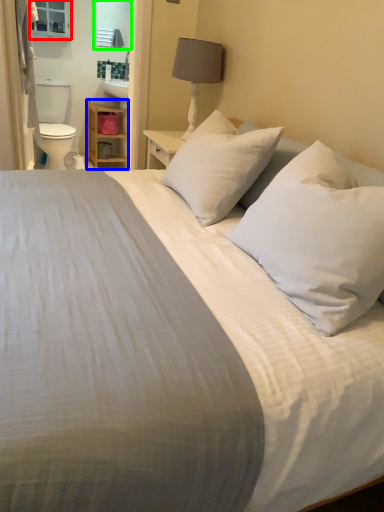
Question: Based on their relative distances, which object is nearer to medicine cabinet (highlighted by a red box)? Choose from dresser (highlighted by a blue box) and mirror (highlighted by a green box).

Choices:
 (A) dresser
 (B) mirror

Answer: (B)